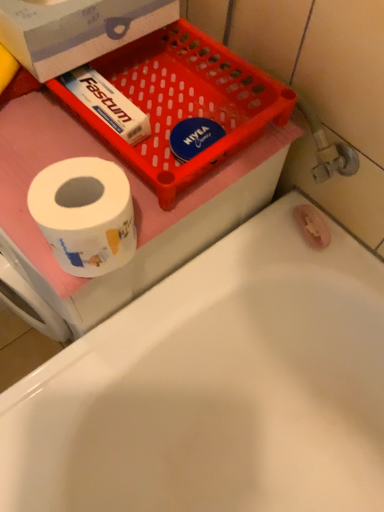
What is the approximate height of white glossy toilet paper at left?

11.06 centimeters.

Describe the element at coordinates (85, 214) in the screenshot. The height and width of the screenshot is (512, 384). I see `white glossy toilet paper at left` at that location.

Describe the element at coordinates (216, 388) in the screenshot. The width and height of the screenshot is (384, 512). I see `white glossy bathtub at lower left` at that location.

The image size is (384, 512). What do you see at coordinates (76, 30) in the screenshot? I see `white cardboard box at upper left` at bounding box center [76, 30].

Describe the element at coordinates (184, 102) in the screenshot. I see `red plastic tray at upper left` at that location.

Identify the location of white glossy toilet paper at left. The image size is (384, 512). (85, 214).

Is white glossy bathtub at lower left bigger than white cardboard box at upper left?

Correct, white glossy bathtub at lower left is larger in size than white cardboard box at upper left.

Would you say white glossy bathtub at lower left is outside white cardboard box at upper left?

That's correct, white glossy bathtub at lower left is outside of white cardboard box at upper left.

Which is nearer, (265, 483) or (16, 36)?

Point (265, 483).

Find the location of a particular element. bathtub located below the white cardboard box at upper left (from the image's perspective) is located at coordinates (216, 388).

Considering the sizes of red plastic tray at upper left and white cardboard box at upper left in the image, is red plastic tray at upper left taller or shorter than white cardboard box at upper left?

Clearly, red plastic tray at upper left is shorter compared to white cardboard box at upper left.

From the image's perspective, is red plastic tray at upper left located beneath white cardboard box at upper left?

Yes, from the image's perspective, red plastic tray at upper left is beneath white cardboard box at upper left.

From a real-world perspective, is red plastic tray at upper left physically above white cardboard box at upper left?

No, from a real-world perspective, red plastic tray at upper left is not on top of white cardboard box at upper left.

Choose the correct answer: Is red plastic tray at upper left inside white cardboard box at upper left or outside it?

red plastic tray at upper left is not inside white cardboard box at upper left, it's outside.

Would you say red plastic tray at upper left is a long distance from white glossy bathtub at lower left?

Actually, red plastic tray at upper left and white glossy bathtub at lower left are a little close together.

How many degrees apart are the facing directions of red plastic tray at upper left and white glossy bathtub at lower left?

They differ by 0.887 degrees in their facing directions.

Is red plastic tray at upper left shorter than white glossy bathtub at lower left?

Yes.

The height and width of the screenshot is (512, 384). Find the location of `basket above the white glossy bathtub at lower left (from a real-world perspective)`. basket above the white glossy bathtub at lower left (from a real-world perspective) is located at coordinates (184, 102).

Which object is further away from the camera, white glossy toilet paper at left or white cardboard box at upper left?

Positioned behind is white cardboard box at upper left.

Is white glossy toilet paper at left oriented away from white cardboard box at upper left?

No, white cardboard box at upper left is not at the back of white glossy toilet paper at left.

This screenshot has height=512, width=384. What are the coordinates of `toilet paper below the white cardboard box at upper left (from a real-world perspective)` in the screenshot? It's located at (85, 214).

From a real-world perspective, is white glossy toilet paper at left under white cardboard box at upper left?

Yes, from a real-world perspective, white glossy toilet paper at left is beneath white cardboard box at upper left.

From a real-world perspective, which object stands above the other?

white glossy toilet paper at left is physically above.

Is point (190, 456) farther from camera compared to point (94, 255)?

Yes, it is.

Considering the sizes of objects white glossy bathtub at lower left and white glossy toilet paper at left in the image provided, who is smaller, white glossy bathtub at lower left or white glossy toilet paper at left?

Smaller between the two is white glossy toilet paper at left.

Could you tell me if white glossy bathtub at lower left is facing white glossy toilet paper at left?

No, white glossy bathtub at lower left is not facing towards white glossy toilet paper at left.

Would you say red plastic tray at upper left is inside or outside white glossy toilet paper at left?

red plastic tray at upper left is located beyond the bounds of white glossy toilet paper at left.

Can you tell me how much red plastic tray at upper left and white glossy toilet paper at left differ in facing direction?

The angular difference between red plastic tray at upper left and white glossy toilet paper at left is 0.891 degrees.

Is red plastic tray at upper left positioned with its back to white glossy toilet paper at left?

No, red plastic tray at upper left is not facing away from white glossy toilet paper at left.

Which object is wider, red plastic tray at upper left or white glossy toilet paper at left?

With larger width is red plastic tray at upper left.

Could you tell me if white glossy bathtub at lower left is turned towards red plastic tray at upper left?

No, white glossy bathtub at lower left does not turn towards red plastic tray at upper left.

Measure the distance between white glossy bathtub at lower left and red plastic tray at upper left.

The distance of white glossy bathtub at lower left from red plastic tray at upper left is 13.07 inches.

Is white glossy bathtub at lower left positioned beyond the bounds of red plastic tray at upper left?

Yes, white glossy bathtub at lower left is located beyond the bounds of red plastic tray at upper left.

From a real-world perspective, is white glossy bathtub at lower left on top of red plastic tray at upper left?

No, from a real-world perspective, white glossy bathtub at lower left is not above red plastic tray at upper left.

You are a GUI agent. You are given a task and a screenshot of the screen. Output one action in this format:
    pyautogui.click(x=<x>, y=<y>)
    Task: Click on the box located on the left of white glossy bathtub at lower left
    Image resolution: width=384 pixels, height=512 pixels.
    Given the screenshot: What is the action you would take?
    (76, 30)

The image size is (384, 512). Identify the location of box above the red plastic tray at upper left (from a real-world perspective). (76, 30).

Considering their positions, is white cardboard box at upper left positioned further to white glossy toilet paper at left than red plastic tray at upper left?

Among the two, white cardboard box at upper left is located further to white glossy toilet paper at left.

Based on their spatial positions, is red plastic tray at upper left or white glossy bathtub at lower left further from white glossy toilet paper at left?

white glossy bathtub at lower left is further to white glossy toilet paper at left.

Considering their positions, is white glossy toilet paper at left positioned closer to white cardboard box at upper left than white glossy bathtub at lower left?

Based on the image, white glossy toilet paper at left appears to be nearer to white cardboard box at upper left.

From the image, which object appears to be farther from white glossy bathtub at lower left, white cardboard box at upper left or red plastic tray at upper left?

white cardboard box at upper left lies further to white glossy bathtub at lower left than the other object.

Which object lies nearer to the anchor point white cardboard box at upper left, red plastic tray at upper left or white glossy bathtub at lower left?

The object closer to white cardboard box at upper left is red plastic tray at upper left.

When comparing their distances from white glossy toilet paper at left, does white glossy bathtub at lower left or red plastic tray at upper left seem closer?

Based on the image, red plastic tray at upper left appears to be nearer to white glossy toilet paper at left.

From the image, which object appears to be nearer to white glossy toilet paper at left, white cardboard box at upper left or white glossy bathtub at lower left?

white cardboard box at upper left is closer to white glossy toilet paper at left.

From the image, which object appears to be farther from white glossy bathtub at lower left, white cardboard box at upper left or white glossy toilet paper at left?

Among the two, white cardboard box at upper left is located further to white glossy bathtub at lower left.

Where is `basket between white cardboard box at upper left and white glossy bathtub at lower left from top to bottom`? The height and width of the screenshot is (512, 384). basket between white cardboard box at upper left and white glossy bathtub at lower left from top to bottom is located at coordinates (184, 102).

Locate an element on the screen. toilet paper between white cardboard box at upper left and white glossy bathtub at lower left from top to bottom is located at coordinates click(x=85, y=214).

Locate an element on the screen. basket that lies between white cardboard box at upper left and white glossy toilet paper at left from top to bottom is located at coordinates (184, 102).

Locate an element on the screen. toilet paper between red plastic tray at upper left and white glossy bathtub at lower left vertically is located at coordinates (85, 214).